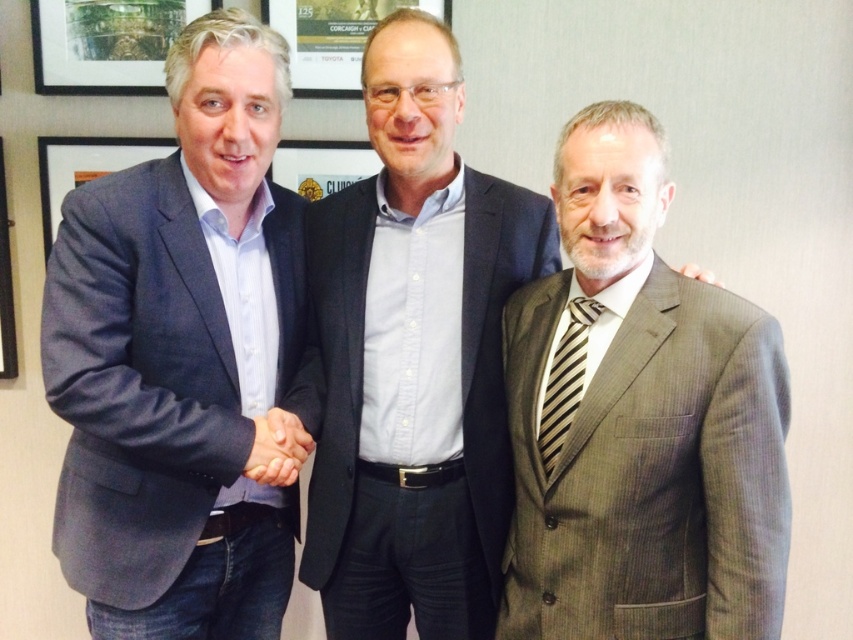
Question: Is gray textured suit at center behind matte glass picture frame at upper left?

Choices:
 (A) yes
 (B) no

Answer: (B)

Question: From the image, what is the correct spatial relationship of gray textured suit at right in relation to matte black picture frame at left?

Choices:
 (A) below
 (B) above

Answer: (A)

Question: Which point is farther to the camera?

Choices:
 (A) matte blue suit at left
 (B) brushed metal picture frame at upper center
 (C) gray textured suit at right

Answer: (B)

Question: Which is farther from the matte black picture frame at left?

Choices:
 (A) matte glass picture frame at upper left
 (B) brushed metal picture frame at upper center
 (C) matte blue suit at left
 (D) gray textured suit at right

Answer: (D)

Question: Which point is farther from the camera taking this photo?

Choices:
 (A) (189, 13)
 (B) (54, 184)
 (C) (300, 275)

Answer: (B)

Question: Can you confirm if matte blue suit at left is positioned above gray textured suit at right?

Choices:
 (A) no
 (B) yes

Answer: (B)